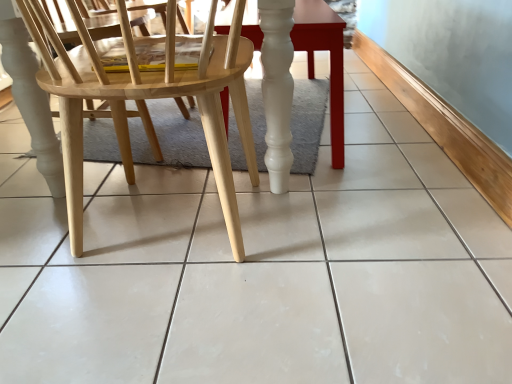
Find the location of a particular element. free location to the right of natural wood chair at left is located at coordinates (368, 234).